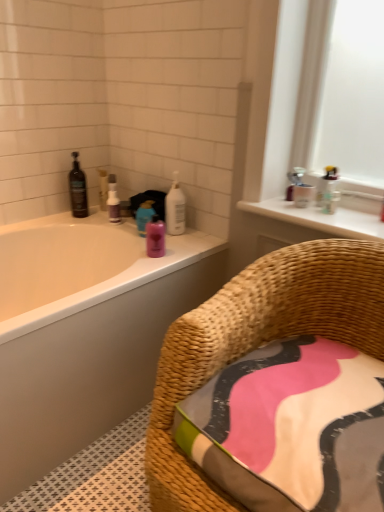
Question: Based on their positions, is woven rattan chair at lower right located to the left or right of translucent plastic bottles at upper right, acting as the second toiletry starting from the bottom?

Choices:
 (A) right
 (B) left

Answer: (B)

Question: Is point (289, 266) closer or farther from the camera than point (337, 200)?

Choices:
 (A) farther
 (B) closer

Answer: (B)

Question: Which is farther from the woven rattan chair at lower right?

Choices:
 (A) translucent plastic bottles at upper right, arranged as the 2th toiletry when viewed from the left
 (B) white glossy window sill at upper right
 (C) white glossy bathtub at upper left
 (D) white glossy bottle at upper center, arranged as the 2th cleaning product when viewed from the left
 (E) purple matte spray bottle at upper left, the second cleaning product positioned from the right

Answer: (E)

Question: Considering the real-world distances, which object is farthest from the woven rattan chair at lower right?

Choices:
 (A) pink glossy bottle at upper center, which is the first toiletry in left-to-right order
 (B) purple matte spray bottle at upper left, the second cleaning product positioned from the right
 (C) white glossy bathtub at upper left
 (D) black glass bottle at upper left
 (E) translucent plastic bottles at upper right, the first toiletry when ordered from right to left

Answer: (D)